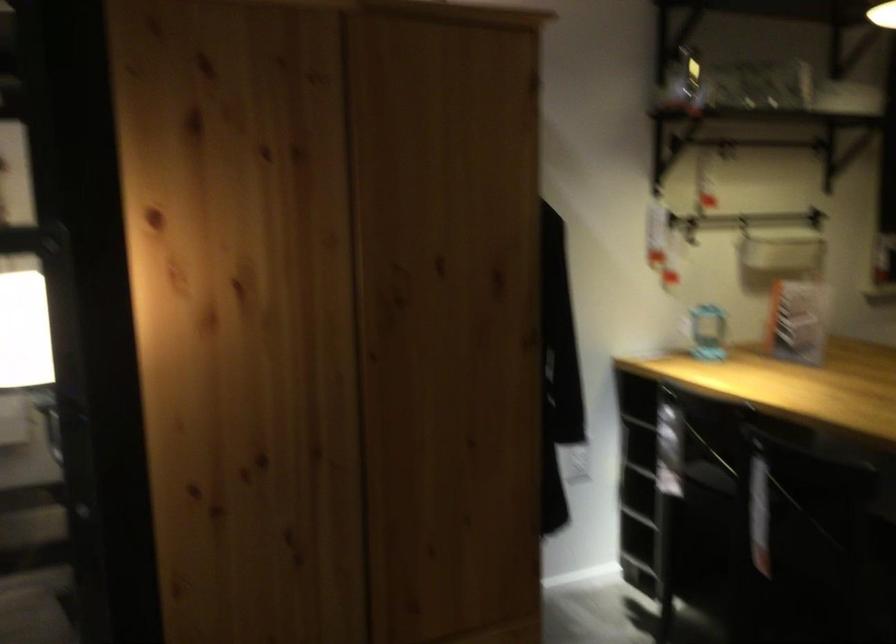
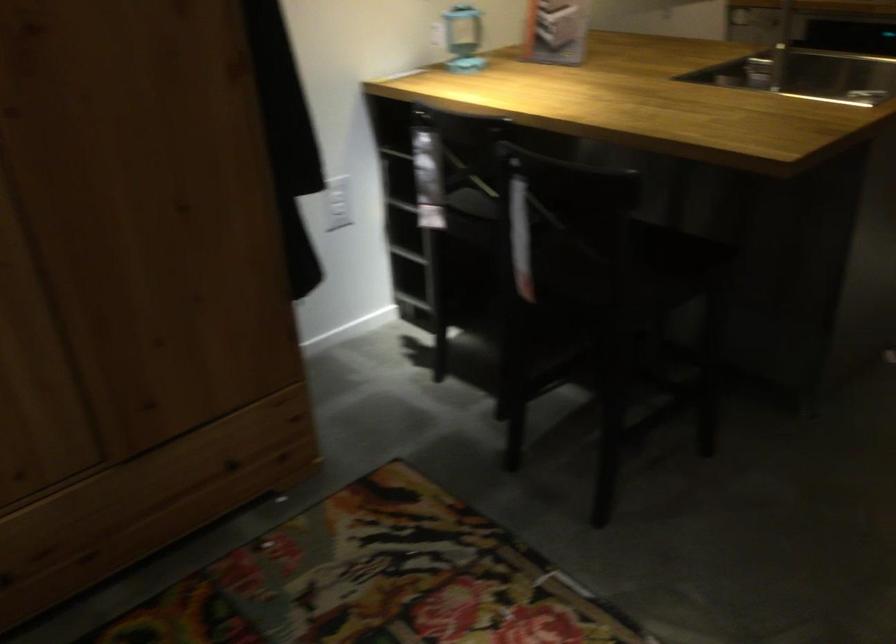
Question: The images are taken continuously from a first-person perspective. In which direction are you moving?

Choices:
 (A) Left
 (B) Right
 (C) Forward
 (D) Backward

Answer: (C)